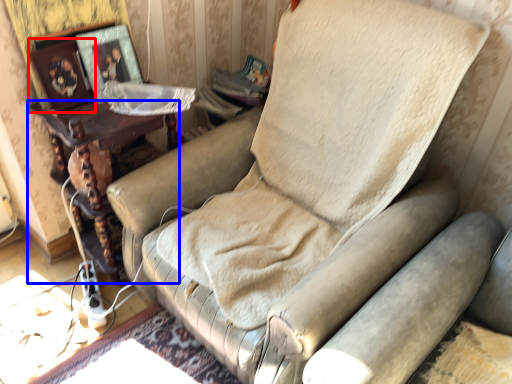
Question: Which object is closer to the camera taking this photo, picture frame (highlighted by a red box) or furniture (highlighted by a blue box)?

Choices:
 (A) picture frame
 (B) furniture

Answer: (A)